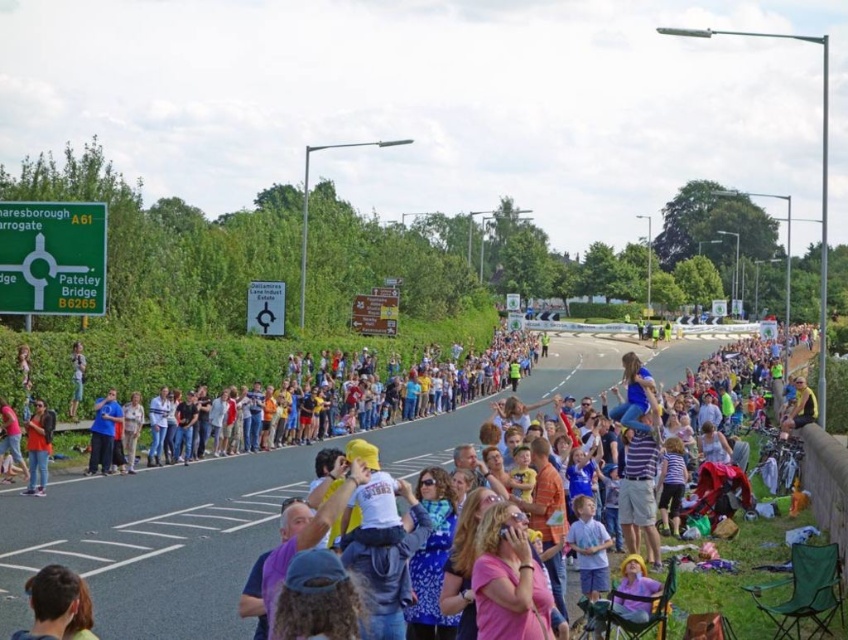
You are a photographer trying to capture a clear shot of the dark brown hair at lower left. However, there is a matte white crowd at center blocking your view. Can you move to the left to get an unobstructed view?

The dark brown hair at lower left is behind the matte white crowd at center, so moving to the left might not help as the crowd is already blocking the view. You might need to move around or find a higher vantage point.

You are a photographer positioned at the camera location. You want to take a photo that includes both the point at (x=567, y=449) and the point at (x=114, y=403). Which point should you focus on to ensure both are in sharp focus?

You should focus on the point at (x=567, y=449) because it is closer to the camera than the point at (x=114, y=403). By focusing on the closer point, the farther point will also be within the depth of field and in focus.

You are a photographer standing at the origin point of the image. You want to take a photo of the matte white crowd at center. Where should you position your camera relative to the crowd?

The matte white crowd at center is located at coordinates point [530,499], so you should position your camera to the right and slightly above the crowd to capture them in the frame.